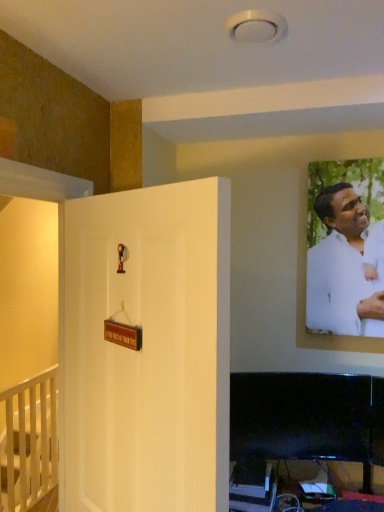
This screenshot has height=512, width=384. What do you see at coordinates (29, 442) in the screenshot?
I see `white wooden railing at lower left, which ranks as the first furniture in left-to-right order` at bounding box center [29, 442].

Where is `white wooden railing at lower left, which is the 2th furniture from right to left`? white wooden railing at lower left, which is the 2th furniture from right to left is located at coordinates (29, 442).

Image resolution: width=384 pixels, height=512 pixels. Describe the element at coordinates (148, 349) in the screenshot. I see `white matte door at center` at that location.

The width and height of the screenshot is (384, 512). What are the coordinates of `black glossy tv at lower right, which is the second furniture from bottom to top` in the screenshot? It's located at (308, 418).

From the image's perspective, which object appears higher, white matte shirt at upper right or black glossy tv at lower right, positioned as the 2th furniture in back-to-front order?

white matte shirt at upper right.

Consider the image. Is white matte shirt at upper right with black glossy tv at lower right, which is the 1th furniture in top-to-bottom order?

white matte shirt at upper right is not next to black glossy tv at lower right, which is the 1th furniture in top-to-bottom order, and they're not touching.

Is white matte shirt at upper right further to camera compared to black glossy tv at lower right, marked as the 2th furniture in a left-to-right arrangement?

That is True.

Is black glossy tv at lower right, the 1th furniture positioned from the right, inside white matte shirt at upper right?

No, black glossy tv at lower right, the 1th furniture positioned from the right, is not surrounded by white matte shirt at upper right.

Does white wooden railing at lower left, arranged as the first furniture when ordered from the bottom, have a greater height compared to black glossy tv at lower right, positioned as the 2th furniture in back-to-front order?

Correct, white wooden railing at lower left, arranged as the first furniture when ordered from the bottom, is much taller as black glossy tv at lower right, positioned as the 2th furniture in back-to-front order.

Can you confirm if white wooden railing at lower left, which is counted as the 2th furniture, starting from the top, is positioned to the right of black glossy tv at lower right, which is the 1th furniture in top-to-bottom order?

In fact, white wooden railing at lower left, which is counted as the 2th furniture, starting from the top, is to the left of black glossy tv at lower right, which is the 1th furniture in top-to-bottom order.

In order to click on furniture on the right of white wooden railing at lower left, which is counted as the 2th furniture, starting from the top in this screenshot , I will do `click(308, 418)`.

Is white wooden railing at lower left, which is the 2th furniture from right to left, in contact with black glossy tv at lower right, positioned as the 2th furniture in back-to-front order?

No, white wooden railing at lower left, which is the 2th furniture from right to left, is not making contact with black glossy tv at lower right, positioned as the 2th furniture in back-to-front order.

Is white matte shirt at upper right turned away from white matte door at center?

No, white matte shirt at upper right is not facing the opposite direction of white matte door at center.

From the image's perspective, which object appears higher, white matte shirt at upper right or white matte door at center?

white matte shirt at upper right is shown above in the image.

In the scene shown: Considering the relative positions of white matte shirt at upper right and white matte door at center in the image provided, is white matte shirt at upper right to the right of white matte door at center from the viewer's perspective?

Yes.

Are white matte shirt at upper right and white matte door at center making contact?

white matte shirt at upper right is not next to white matte door at center, and they're not touching.

Choose the correct answer: Is white matte door at center inside white wooden railing at lower left, which is the 2th furniture from right to left, or outside it?

white matte door at center is outside white wooden railing at lower left, which is the 2th furniture from right to left.

You are a GUI agent. You are given a task and a screenshot of the screen. Output one action in this format:
    pyautogui.click(x=<x>, y=<y>)
    Task: Click on the furniture on the left of white matte door at center
    Image resolution: width=384 pixels, height=512 pixels.
    Given the screenshot: What is the action you would take?
    coord(29,442)

Between white matte door at center and white wooden railing at lower left, arranged as the first furniture when ordered from the bottom, which one appears on the left side from the viewer's perspective?

From the viewer's perspective, white wooden railing at lower left, arranged as the first furniture when ordered from the bottom, appears more on the left side.

Is white matte door at center with white wooden railing at lower left, which ranks as the first furniture in left-to-right order?

No, white matte door at center is not with white wooden railing at lower left, which ranks as the first furniture in left-to-right order.

In the image, there is a white matte door at center. Where is `man above it (from the image's perspective)`? The width and height of the screenshot is (384, 512). man above it (from the image's perspective) is located at coordinates (342, 269).

Who is smaller, white matte door at center or white matte shirt at upper right?

Smaller between the two is white matte shirt at upper right.

Considering the relative sizes of white matte door at center and white matte shirt at upper right in the image provided, is white matte door at center shorter than white matte shirt at upper right?

Incorrect, the height of white matte door at center does not fall short of that of white matte shirt at upper right.

Does point (75, 199) come closer to viewer compared to point (317, 304)?

Yes, it is.

Can we say white wooden railing at lower left, arranged as the first furniture when viewed from the back, lies outside white matte door at center?

Absolutely, white wooden railing at lower left, arranged as the first furniture when viewed from the back, is external to white matte door at center.

Is white wooden railing at lower left, arranged as the first furniture when ordered from the bottom, to the left of white matte door at center from the viewer's perspective?

Correct, you'll find white wooden railing at lower left, arranged as the first furniture when ordered from the bottom, to the left of white matte door at center.

How different are the orientations of white wooden railing at lower left, arranged as the first furniture when viewed from the back, and white matte door at center in degrees?

They differ by 119 degrees in their facing directions.

Considering their positions, is black glossy tv at lower right, the 1th furniture positioned from the right, located in front of or behind white matte door at center?

In the image, black glossy tv at lower right, the 1th furniture positioned from the right, appears behind white matte door at center.

From a real-world perspective, relative to white matte door at center, is black glossy tv at lower right, which is the second furniture from bottom to top, vertically above or below?

From a real-world perspective, black glossy tv at lower right, which is the second furniture from bottom to top, is physically below white matte door at center.

Looking at the image, does black glossy tv at lower right, acting as the 1th furniture starting from the front, seem bigger or smaller compared to white matte door at center?

In the image, black glossy tv at lower right, acting as the 1th furniture starting from the front, appears to be smaller than white matte door at center.

Is black glossy tv at lower right, positioned as the 2th furniture in back-to-front order, located outside white matte door at center?

Absolutely, black glossy tv at lower right, positioned as the 2th furniture in back-to-front order, is external to white matte door at center.

This screenshot has width=384, height=512. What are the coordinates of `man on the right side of black glossy tv at lower right, marked as the 2th furniture in a left-to-right arrangement` in the screenshot? It's located at (342, 269).

You are a GUI agent. You are given a task and a screenshot of the screen. Output one action in this format:
    pyautogui.click(x=<x>, y=<y>)
    Task: Click on the furniture located on the left of black glossy tv at lower right, marked as the 2th furniture in a left-to-right arrangement
    The height and width of the screenshot is (512, 384).
    Given the screenshot: What is the action you would take?
    pyautogui.click(x=29, y=442)

Looking at this image, considering their positions, is white matte shirt at upper right positioned closer to black glossy tv at lower right, marked as the 2th furniture in a left-to-right arrangement, than white matte door at center?

Among the two, white matte shirt at upper right is located nearer to black glossy tv at lower right, marked as the 2th furniture in a left-to-right arrangement.

When comparing their distances from white matte shirt at upper right, does black glossy tv at lower right, the 1th furniture positioned from the right, or white matte door at center seem further?

The object further to white matte shirt at upper right is white matte door at center.

When comparing their distances from black glossy tv at lower right, marked as the 2th furniture in a left-to-right arrangement, does white matte door at center or white wooden railing at lower left, marked as the second furniture in a front-to-back arrangement, seem closer?

Among the two, white matte door at center is located nearer to black glossy tv at lower right, marked as the 2th furniture in a left-to-right arrangement.

Considering their positions, is white wooden railing at lower left, which is counted as the 2th furniture, starting from the top, positioned closer to white matte shirt at upper right than white matte door at center?

white matte door at center is closer to white matte shirt at upper right.

When comparing their distances from white wooden railing at lower left, marked as the second furniture in a front-to-back arrangement, does white matte door at center or white matte shirt at upper right seem further?

The object further to white wooden railing at lower left, marked as the second furniture in a front-to-back arrangement, is white matte shirt at upper right.

Considering their positions, is black glossy tv at lower right, the 1th furniture positioned from the right, positioned closer to white matte door at center than white wooden railing at lower left, which is counted as the 2th furniture, starting from the top?

The object closer to white matte door at center is black glossy tv at lower right, the 1th furniture positioned from the right.

When comparing their distances from white wooden railing at lower left, marked as the second furniture in a front-to-back arrangement, does black glossy tv at lower right, positioned as the 2th furniture in back-to-front order, or white matte door at center seem further?

white matte door at center lies further to white wooden railing at lower left, marked as the second furniture in a front-to-back arrangement, than the other object.

Which object lies further to the anchor point white wooden railing at lower left, which is counted as the 2th furniture, starting from the top, white matte shirt at upper right or black glossy tv at lower right, which is the second furniture from bottom to top?

white matte shirt at upper right.

Where is `furniture located between white wooden railing at lower left, arranged as the first furniture when ordered from the bottom, and white matte shirt at upper right in the left-right direction`? furniture located between white wooden railing at lower left, arranged as the first furniture when ordered from the bottom, and white matte shirt at upper right in the left-right direction is located at coordinates (308, 418).

Locate an element on the screen. This screenshot has width=384, height=512. furniture positioned between white matte door at center and white wooden railing at lower left, arranged as the first furniture when viewed from the back, from near to far is located at coordinates (308, 418).

The height and width of the screenshot is (512, 384). Find the location of `furniture positioned between white matte door at center and white matte shirt at upper right from near to far`. furniture positioned between white matte door at center and white matte shirt at upper right from near to far is located at coordinates (308, 418).

This screenshot has height=512, width=384. I want to click on door between white wooden railing at lower left, which is the 2th furniture from right to left, and white matte shirt at upper right, so click(148, 349).